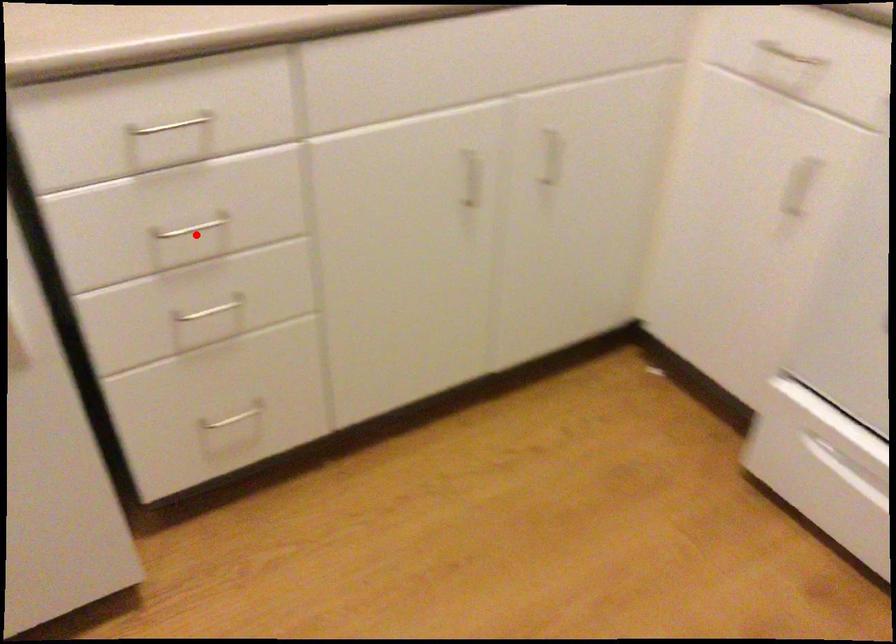
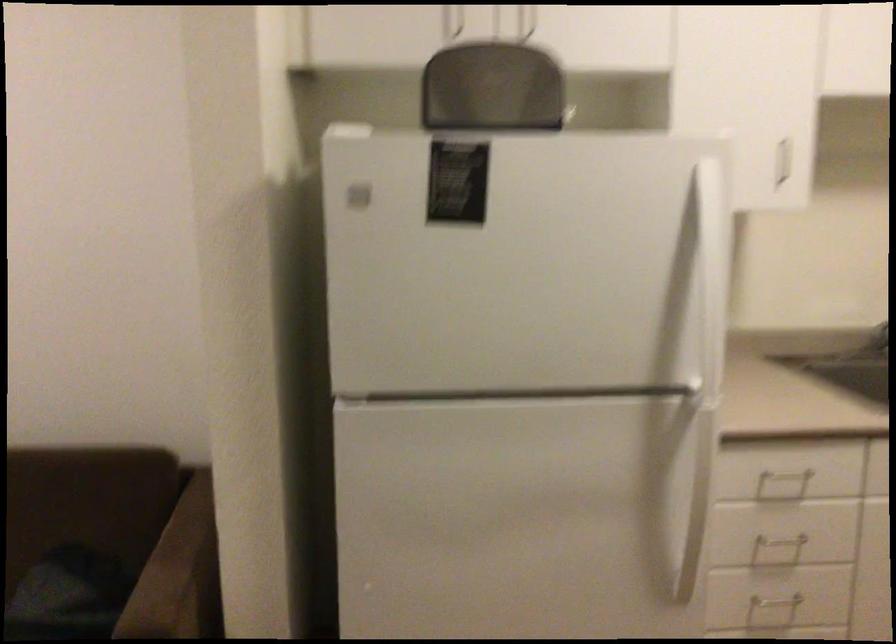
Question: I am providing you with two images of the same scene from different viewpoints. Image1 has a red point marked. In image2, the corresponding 3D location appears at what relative position? Reply with the corresponding letter.

Choices:
 (A) Closer
 (B) Farther

Answer: (B)